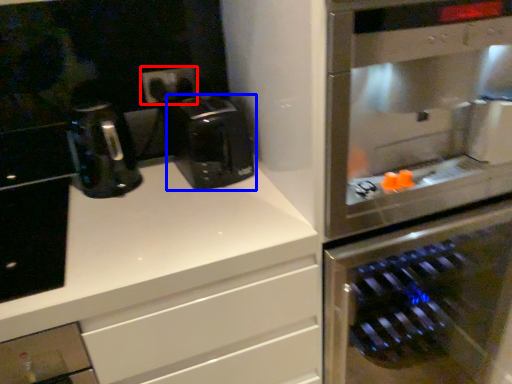
Question: Which object is further to the camera taking this photo, electric outlet (highlighted by a red box) or coffee maker (highlighted by a blue box)?

Choices:
 (A) electric outlet
 (B) coffee maker

Answer: (A)